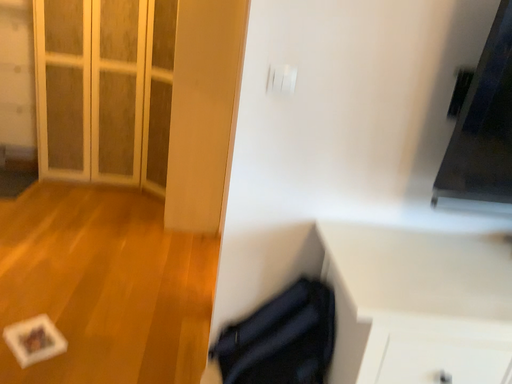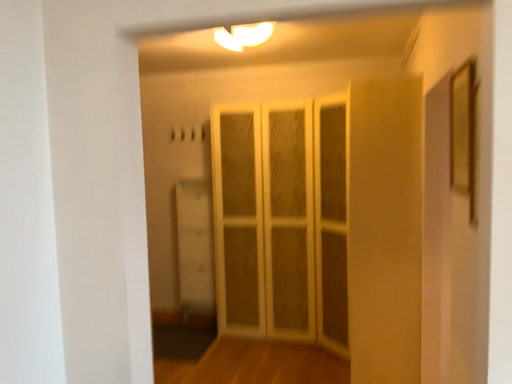
Question: How did the camera likely rotate when shooting the video?

Choices:
 (A) rotated upward
 (B) rotated downward

Answer: (A)